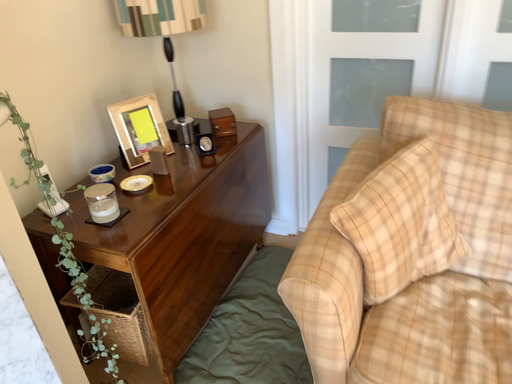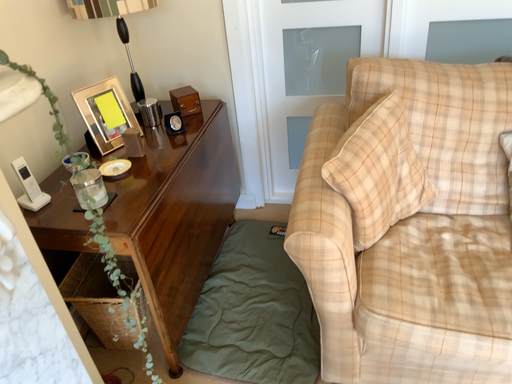
Question: How did the camera likely rotate when shooting the video?

Choices:
 (A) rotated right
 (B) rotated left

Answer: (A)